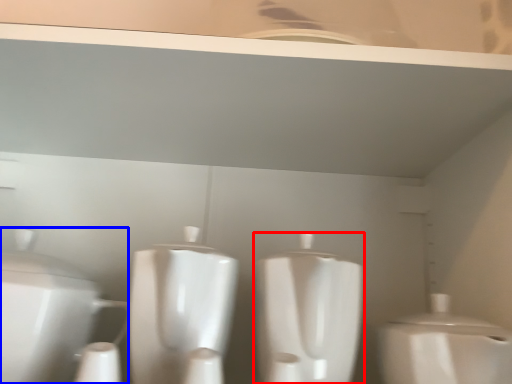
Question: Which point is closer to the camera, toilet (highlighted by a red box) or toilet (highlighted by a blue box)?

Choices:
 (A) toilet
 (B) toilet

Answer: (A)